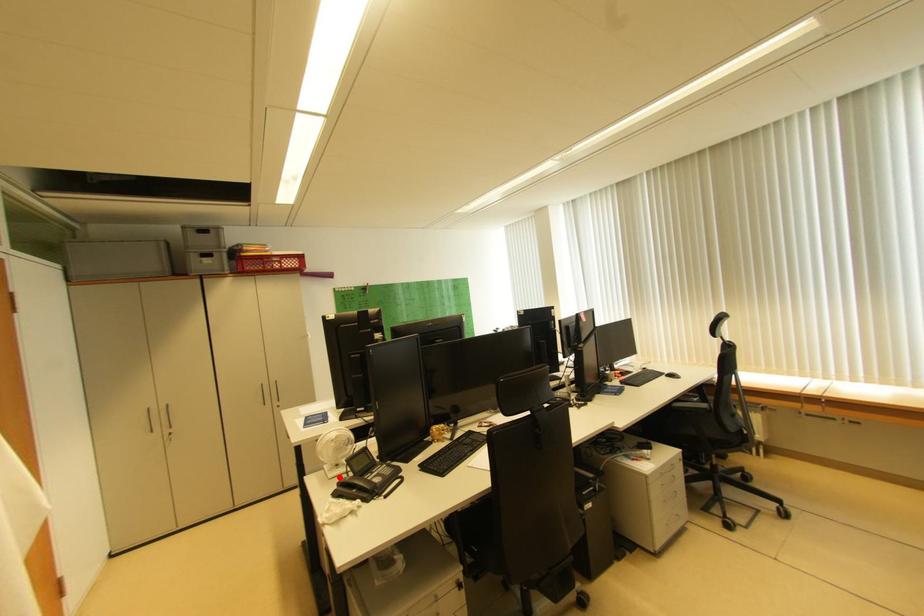
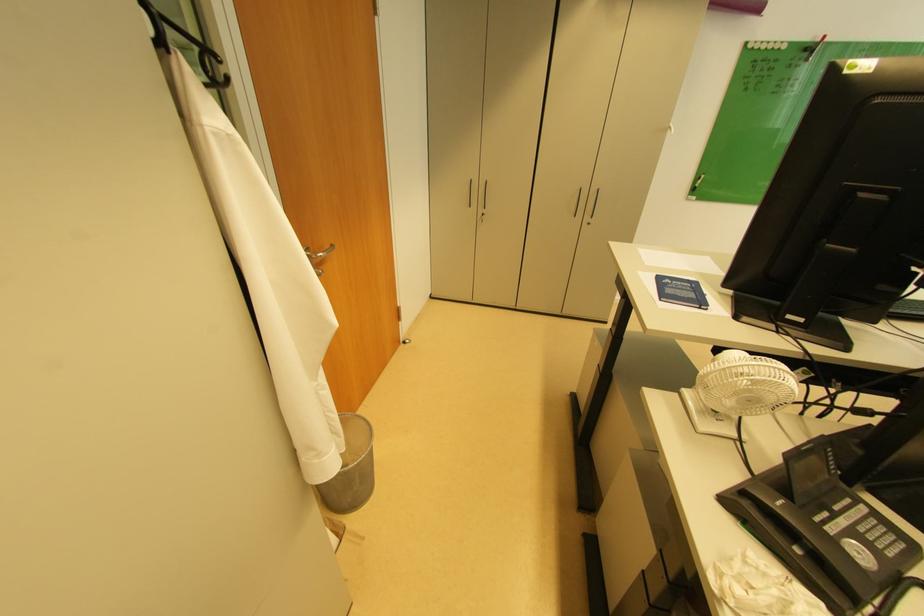
Where in the second image is the point corresponding to the highlighted location from the first image?

(711, 430)